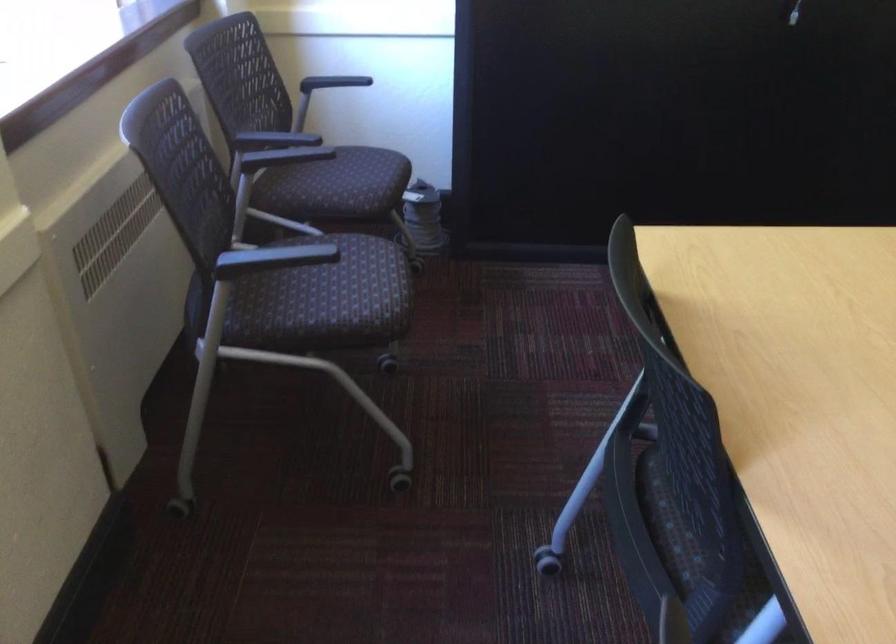
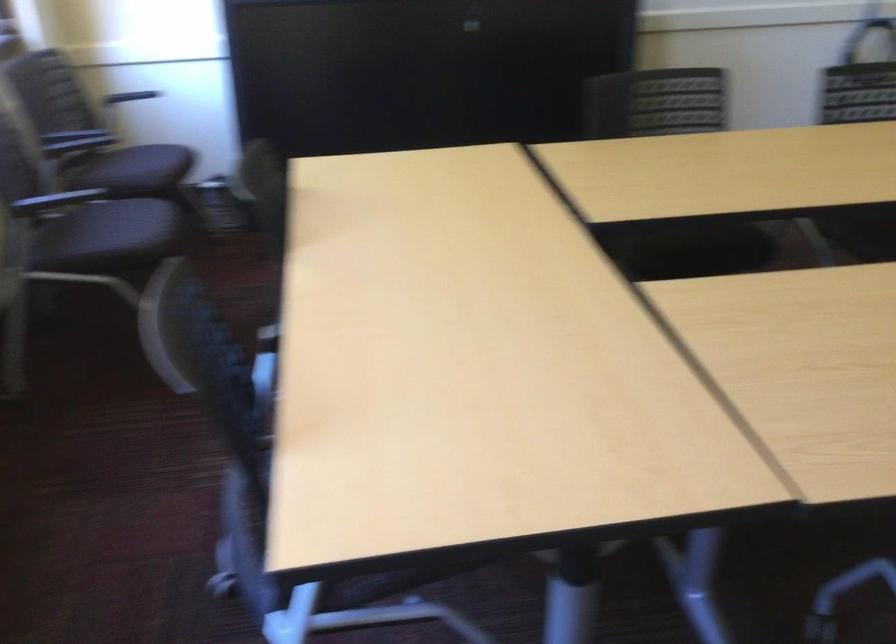
Locate, in the second image, the point that corresponds to [343,185] in the first image.

(135, 169)